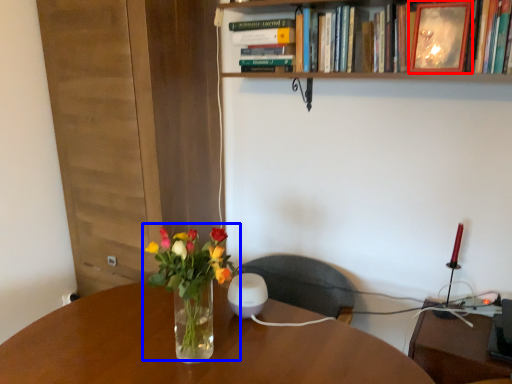
Question: Among these objects, which one is nearest to the camera, picture frame (highlighted by a red box) or floral arrangement (highlighted by a blue box)?

Choices:
 (A) picture frame
 (B) floral arrangement

Answer: (B)